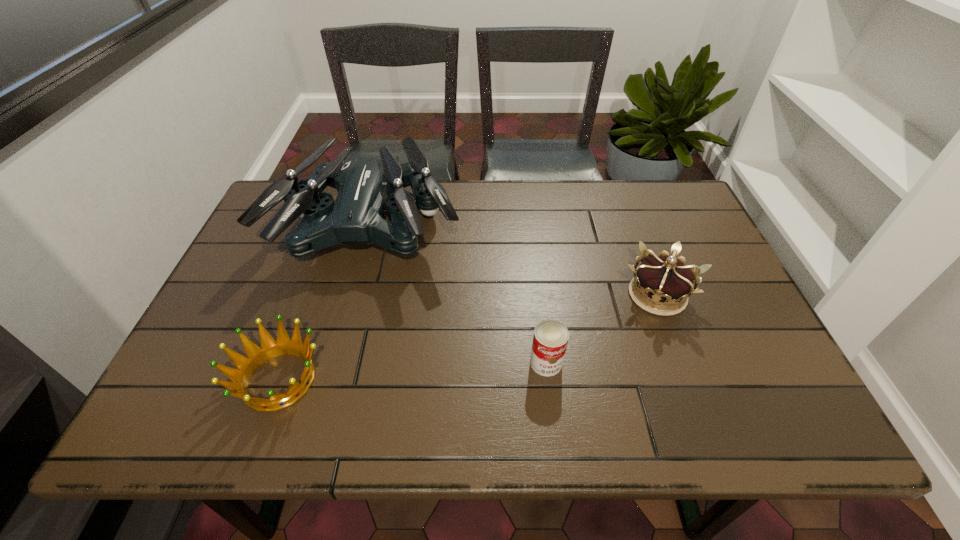
This screenshot has width=960, height=540. Find the location of `object located at the far edge`. object located at the far edge is located at coordinates pos(365,182).

The width and height of the screenshot is (960, 540). I want to click on object present at the near edge, so click(x=256, y=356).

Locate an element on the screen. drone that is at the left edge is located at coordinates (365, 182).

This screenshot has width=960, height=540. I want to click on crown that is at the left edge, so click(256, 356).

Locate an element on the screen. The image size is (960, 540). object present at the right edge is located at coordinates (663, 280).

Where is `object that is at the far left corner`? The image size is (960, 540). object that is at the far left corner is located at coordinates (365, 182).

Where is `object that is at the near left corner`? The height and width of the screenshot is (540, 960). object that is at the near left corner is located at coordinates (256, 356).

Find the location of a particular element. Image resolution: width=960 pixels, height=540 pixels. free space at the far edge of the desktop is located at coordinates (527, 192).

This screenshot has width=960, height=540. In the image, there is a desktop. Identify the location of vacant space at the left edge. (x=267, y=268).

This screenshot has height=540, width=960. What are the coordinates of `free spot at the right edge of the desktop` in the screenshot? It's located at (737, 315).